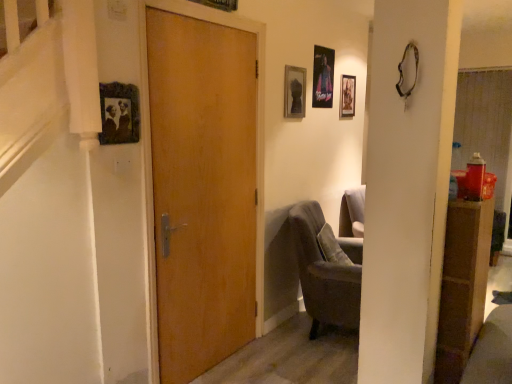
Locate an element on the screen. The image size is (512, 384). vacant point above wooden door at center (from a real-world perspective) is located at coordinates (206, 18).